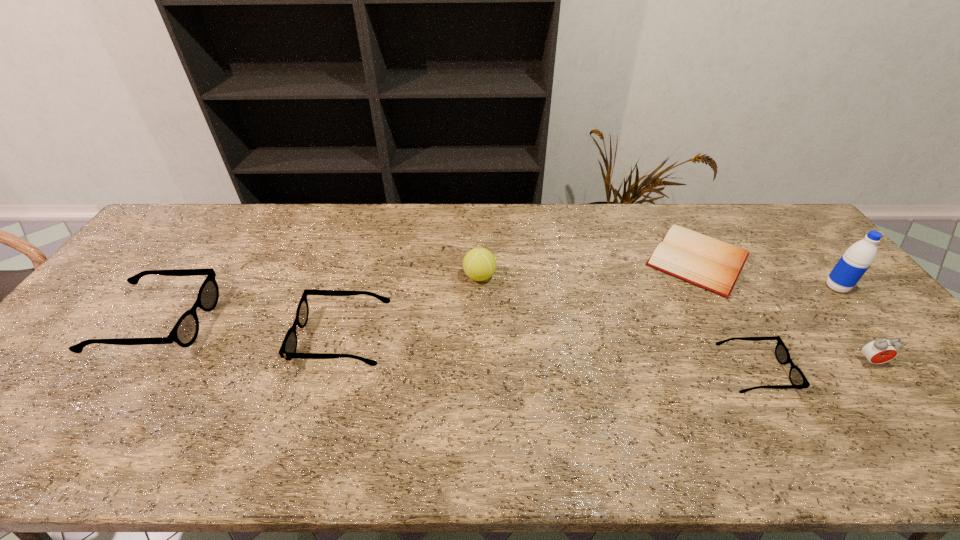
Image resolution: width=960 pixels, height=540 pixels. I want to click on object present at the near edge, so (798, 380).

Identify the location of object positioned at the left edge. (184, 333).

You are a GUI agent. You are given a task and a screenshot of the screen. Output one action in this format:
    pyautogui.click(x=<x>, y=<y>)
    Task: Click on the water bottle that is at the right edge
    This screenshot has height=540, width=960.
    Given the screenshot: What is the action you would take?
    pyautogui.click(x=857, y=259)

Where is `alarm clock situated at the right edge`? The image size is (960, 540). alarm clock situated at the right edge is located at coordinates (878, 351).

At what (x,y) coordinates should I click in order to perform the action: click on vacant space at the far edge of the desktop. Please return your answer as a coordinate pair (x, y). The height and width of the screenshot is (540, 960). Looking at the image, I should click on 287,208.

In order to click on vacant space at the near edge of the desktop in this screenshot , I will do `click(797, 396)`.

In the image, there is a desktop. Where is `vacant region at the left edge`? The image size is (960, 540). vacant region at the left edge is located at coordinates (137, 321).

In the image, there is a desktop. In order to click on vacant space at the right edge in this screenshot , I will do `click(820, 286)`.

This screenshot has height=540, width=960. In the image, there is a desktop. Find the location of `vacant area at the far left corner`. vacant area at the far left corner is located at coordinates click(194, 204).

This screenshot has width=960, height=540. I want to click on vacant area between the tennis ball and the fifth tallest object, so click(x=412, y=307).